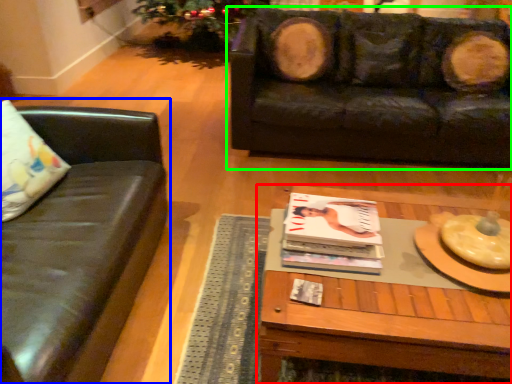
Question: Based on their relative distances, which object is nearer to coffee table (highlighted by a red box)? Choose from studio couch (highlighted by a blue box) and studio couch (highlighted by a green box).

Choices:
 (A) studio couch
 (B) studio couch

Answer: (A)